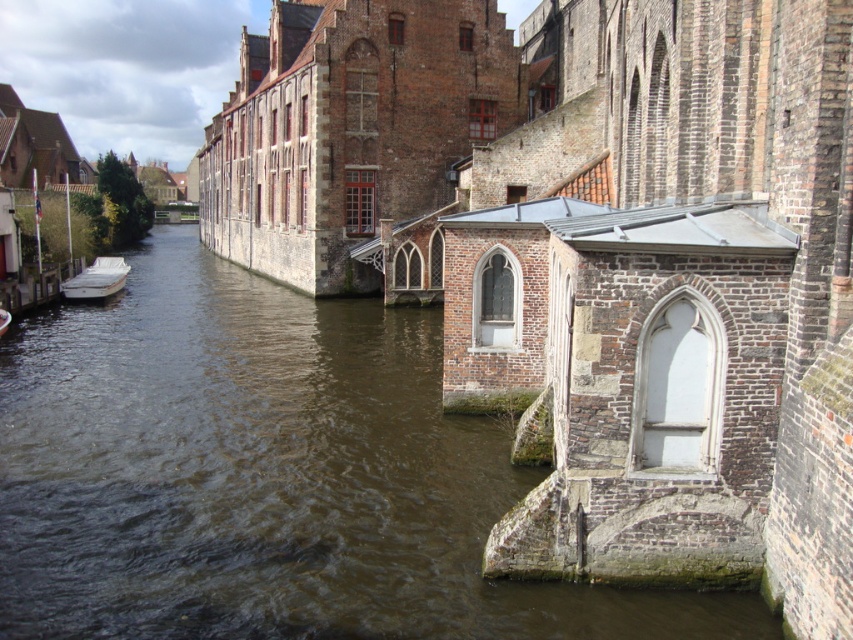
Between brown water at center and white matte boat at left, which one appears on the right side from the viewer's perspective?

From the viewer's perspective, brown water at center appears more on the right side.

Is brown water at center thinner than white matte boat at left?

Incorrect, brown water at center's width is not less than white matte boat at left's.

You are a GUI agent. You are given a task and a screenshot of the screen. Output one action in this format:
    pyautogui.click(x=<x>, y=<y>)
    Task: Click on the brown water at center
    This screenshot has width=853, height=640.
    Given the screenshot: What is the action you would take?
    pyautogui.click(x=270, y=476)

Locate an element on the screen. white matte boat at left is located at coordinates (96, 280).

Does white matte boat at left have a greater width compared to white glossy boat at left?

Yes, white matte boat at left is wider than white glossy boat at left.

Is point (103, 280) in front of point (0, 323)?

That is False.

Image resolution: width=853 pixels, height=640 pixels. I want to click on white matte boat at left, so click(96, 280).

Is point (39, 497) positioned after point (4, 321)?

No, it is in front of (4, 321).

Which is behind, point (329, 339) or point (3, 310)?

Positioned behind is point (329, 339).

What are the coordinates of `brown water at center` in the screenshot? It's located at (270, 476).